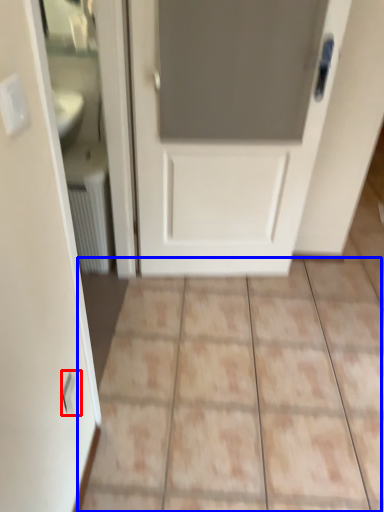
Question: Among these objects, which one is nearest to the camera, electric outlet (highlighted by a red box) or ceramic tile (highlighted by a blue box)?

Choices:
 (A) electric outlet
 (B) ceramic tile

Answer: (A)